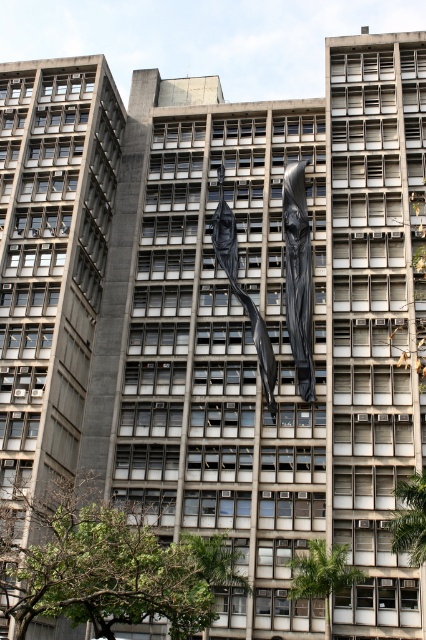
At what (x,y) coordinates should I click in order to perform the action: click on black glossy statue at center. Please return your answer as a coordinate pair (x, y). This screenshot has width=426, height=640. Looking at the image, I should click on (299, 276).

Can you confirm if black glossy statue at center is positioned to the left of black matte sculpture at center?

In fact, black glossy statue at center is to the right of black matte sculpture at center.

You are a GUI agent. You are given a task and a screenshot of the screen. Output one action in this format:
    pyautogui.click(x=<x>, y=<y>)
    Task: Click on the black glossy statue at center
    
    Given the screenshot: What is the action you would take?
    click(x=299, y=276)

Locate an element on the screen. The image size is (426, 640). black glossy statue at center is located at coordinates (299, 276).